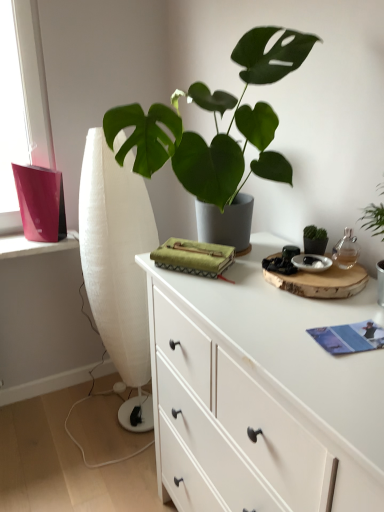
Question: Is white fabric curtain at left a part of blue paper book at lower right?

Choices:
 (A) yes
 (B) no

Answer: (B)

Question: Is blue paper book at lower right far away from white fabric curtain at left?

Choices:
 (A) yes
 (B) no

Answer: (A)

Question: From a real-world perspective, is blue paper book at lower right under white fabric curtain at left?

Choices:
 (A) yes
 (B) no

Answer: (B)

Question: Considering the relative sizes of blue paper book at lower right and white fabric curtain at left in the image provided, is blue paper book at lower right shorter than white fabric curtain at left?

Choices:
 (A) no
 (B) yes

Answer: (B)

Question: Can you confirm if blue paper book at lower right is bigger than white fabric curtain at left?

Choices:
 (A) yes
 (B) no

Answer: (B)

Question: From the image's perspective, is blue paper book at lower right under white fabric curtain at left?

Choices:
 (A) no
 (B) yes

Answer: (B)

Question: Is blue paper book at lower right at the left side of green matte plant at center?

Choices:
 (A) yes
 (B) no

Answer: (B)

Question: Does blue paper book at lower right contain green matte plant at center?

Choices:
 (A) no
 (B) yes

Answer: (A)

Question: From the image's perspective, is blue paper book at lower right above green matte plant at center?

Choices:
 (A) no
 (B) yes

Answer: (A)

Question: Is the position of blue paper book at lower right more distant than that of green matte plant at center?

Choices:
 (A) yes
 (B) no

Answer: (A)

Question: Is blue paper book at lower right beside green matte plant at center?

Choices:
 (A) yes
 (B) no

Answer: (B)

Question: Does blue paper book at lower right have a lesser height compared to green matte plant at center?

Choices:
 (A) yes
 (B) no

Answer: (A)

Question: Is white fabric curtain at left taller than blue paper book at lower right?

Choices:
 (A) yes
 (B) no

Answer: (A)